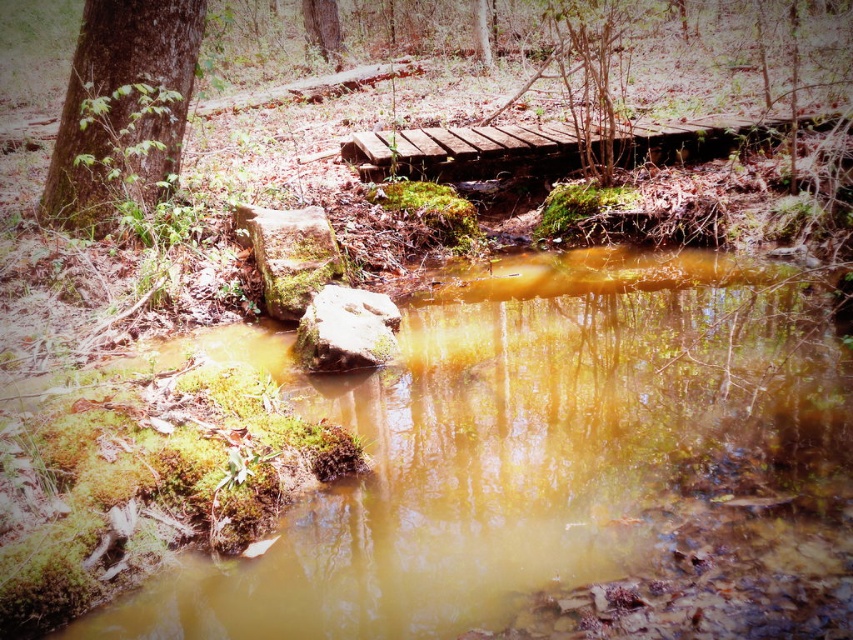
Question: In this image, where is green mossy tree trunk at left located relative to rustic wooden bridge at center?

Choices:
 (A) right
 (B) left

Answer: (B)

Question: Which object is the closest to the green mossy tree at upper center?

Choices:
 (A) green mossy rock at center-left
 (B) green mossy tree trunk at left
 (C) rustic wooden bridge at center

Answer: (C)

Question: Is rustic wooden bridge at center smaller than green mossy rock at center?

Choices:
 (A) no
 (B) yes

Answer: (A)

Question: Is green mossy rock at center below green mossy tree at upper center?

Choices:
 (A) no
 (B) yes

Answer: (B)

Question: Which point is farther from the camera taking this photo?

Choices:
 (A) (466, 164)
 (B) (91, 102)
 (C) (363, 300)

Answer: (A)

Question: Among these points, which one is nearest to the camera?

Choices:
 (A) (173, 42)
 (B) (305, 276)
 (C) (341, 320)
 (D) (715, 154)

Answer: (C)